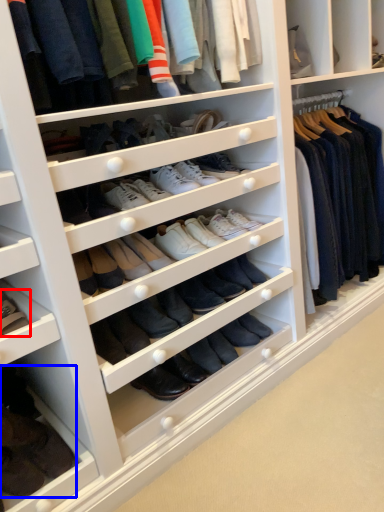
Question: Which of the following is the farthest to the observer, footwear (highlighted by a red box) or footwear (highlighted by a blue box)?

Choices:
 (A) footwear
 (B) footwear

Answer: (A)